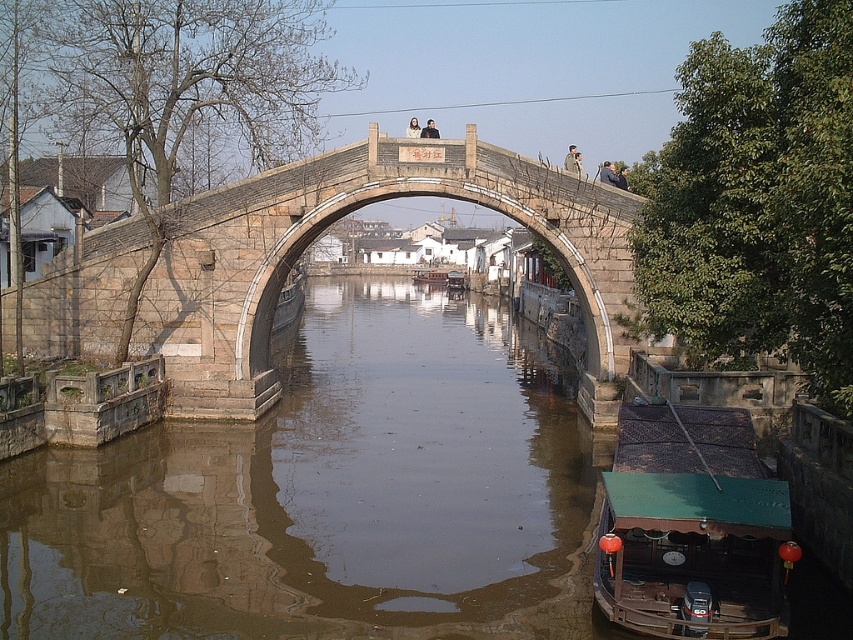
You are an architect designing a new bridge that must be taller than the dark gray fabric jacket at upper center. Based on the scene, can the brown stone water at center help determine if the bridge will meet this requirement?

The brown stone water at center is taller than the dark gray fabric jacket at upper center, so if the bridge is designed to be at least as tall as the brown stone water at center, it will meet the requirement of being taller than the dark gray fabric jacket at upper center.

You are a photographer standing on the stone arch bridge and want to take a photo of the smooth skin person at upper center and the dark gray fabric jacket at upper center. Which object is positioned in front of the other?

The smooth skin person at upper center is closer to the viewer than the dark gray fabric jacket at upper center, so the smooth skin person at upper center is positioned in front of the dark gray fabric jacket at upper center.

You are a photographer standing at point (608,173). You want to capture a photo of the smooth skin person at upper center. Is the person within your current field of view?

Yes, the smooth skin person at upper center is located exactly at point (608,173), so they are directly in your field of view.